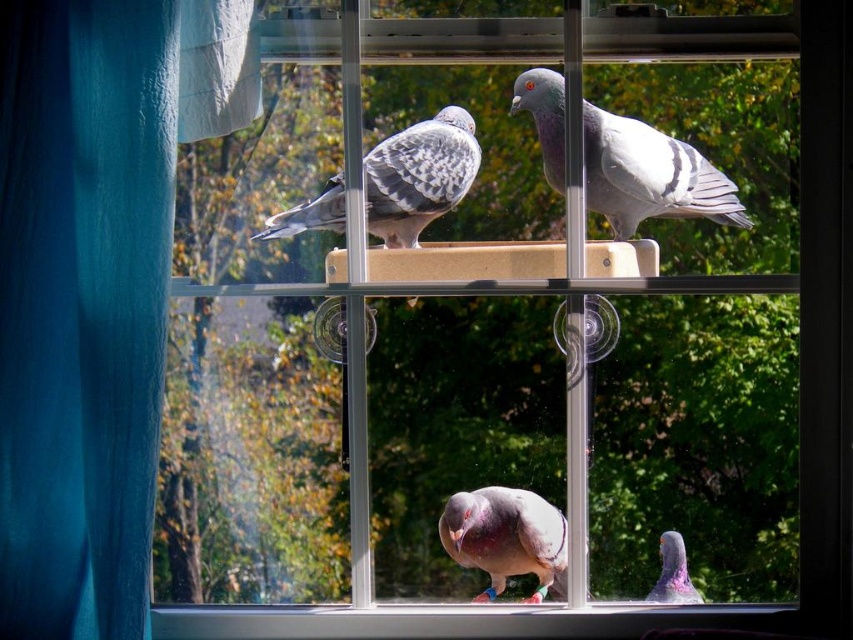
You are looking through the window and see the gray speckled pigeon at upper center and the speckled feathered pigeon at upper left. Which one is higher up?

The gray speckled pigeon at upper center is higher up because it is located above the speckled feathered pigeon at upper left.